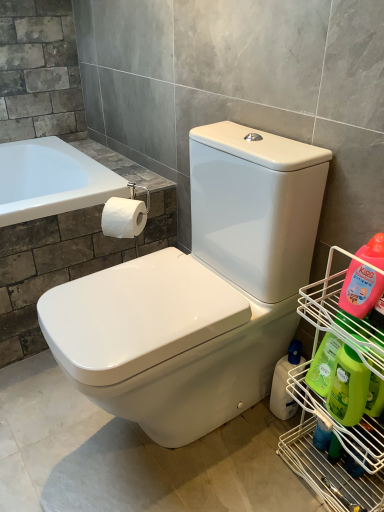
Question: Is white matte toilet paper at upper left facing towards metal wire rack at right?

Choices:
 (A) no
 (B) yes

Answer: (A)

Question: Is white matte toilet paper at upper left oriented away from metal wire rack at right?

Choices:
 (A) yes
 (B) no

Answer: (B)

Question: Is white matte toilet paper at upper left far from metal wire rack at right?

Choices:
 (A) no
 (B) yes

Answer: (A)

Question: Is white matte toilet paper at upper left to the right of metal wire rack at right from the viewer's perspective?

Choices:
 (A) yes
 (B) no

Answer: (B)

Question: Is white matte toilet paper at upper left shorter than metal wire rack at right?

Choices:
 (A) no
 (B) yes

Answer: (B)

Question: Is white matte toilet paper at upper left to the left of metal wire rack at right from the viewer's perspective?

Choices:
 (A) no
 (B) yes

Answer: (B)

Question: Considering the relative sizes of metal wire rack at right and translucent plastic bottle at lower right, the 4th cleaning product from the front, in the image provided, is metal wire rack at right taller than translucent plastic bottle at lower right, the 4th cleaning product from the front,?

Choices:
 (A) no
 (B) yes

Answer: (B)

Question: Is the position of metal wire rack at right more distant than that of translucent plastic bottle at lower right, which is the 1th cleaning product in back-to-front order?

Choices:
 (A) yes
 (B) no

Answer: (B)

Question: Considering the relative sizes of metal wire rack at right and translucent plastic bottle at lower right, the 4th cleaning product from the front, in the image provided, is metal wire rack at right bigger than translucent plastic bottle at lower right, the 4th cleaning product from the front,?

Choices:
 (A) yes
 (B) no

Answer: (A)

Question: Is metal wire rack at right to the right of translucent plastic bottle at lower right, which is the 1th cleaning product in back-to-front order, from the viewer's perspective?

Choices:
 (A) yes
 (B) no

Answer: (A)

Question: From a real-world perspective, is metal wire rack at right below translucent plastic bottle at lower right, the 4th cleaning product from the front?

Choices:
 (A) no
 (B) yes

Answer: (A)

Question: Is metal wire rack at right oriented away from translucent plastic bottle at lower right, the 4th cleaning product from the front?

Choices:
 (A) yes
 (B) no

Answer: (B)

Question: Is green plastic bottle at right, arranged as the third cleaning product when viewed from the front, placed right next to green matte bottle at lower right, the 3th cleaning product positioned from the back?

Choices:
 (A) no
 (B) yes

Answer: (B)